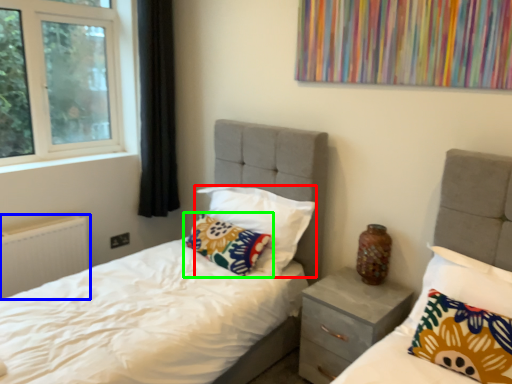
Question: Which object is positioned closest to pillow (highlighted by a red box)? Select from radiator (highlighted by a blue box) and pillow (highlighted by a green box).

Choices:
 (A) radiator
 (B) pillow

Answer: (B)